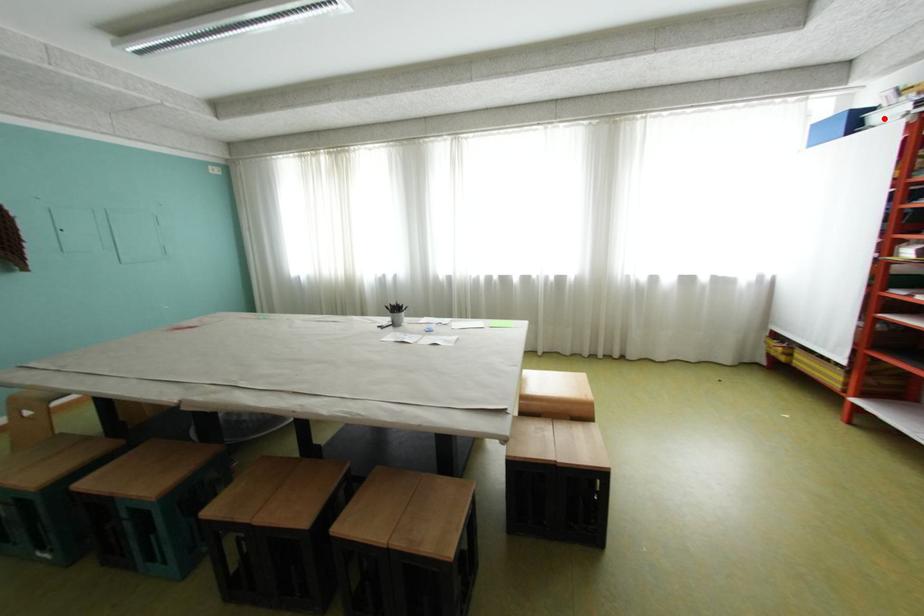
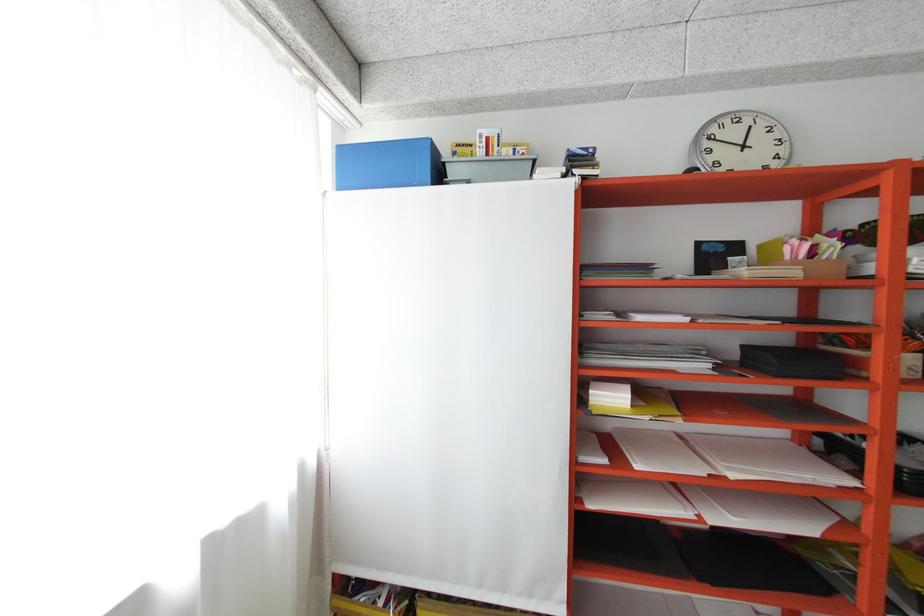
Question: A red point is marked in image1. In image2, is the corresponding 3D point closer to the camera or farther? Reply with the corresponding letter.

Choices:
 (A) The corresponding 3D point is closer.
 (B) The corresponding 3D point is farther.

Answer: (A)